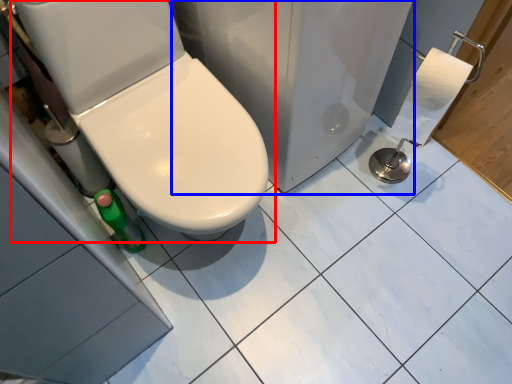
Question: Which object appears closest to the camera in this image, toilet (highlighted by a red box) or porcelain (highlighted by a blue box)?

Choices:
 (A) toilet
 (B) porcelain

Answer: (A)